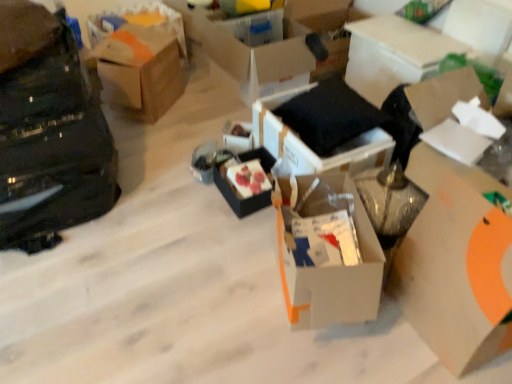
The width and height of the screenshot is (512, 384). Identify the location of free spot to the left of white cardboard box at center, the fifth box positioned from the right. (218, 283).